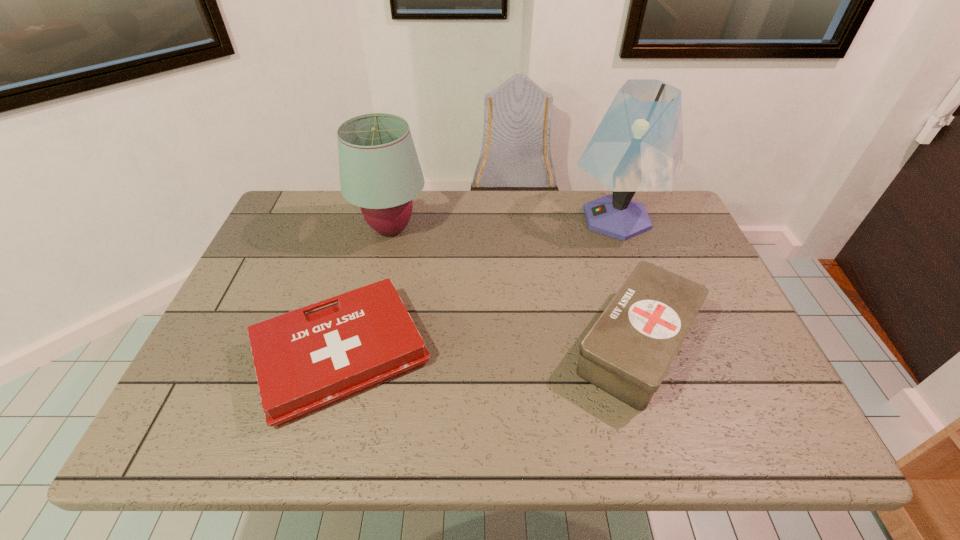
Find the location of a particular element. the right lampshade is located at coordinates [x=638, y=146].

Where is `the taller lampshade`? The image size is (960, 540). the taller lampshade is located at coordinates (638, 146).

Find the location of `the shorter lampshade`. the shorter lampshade is located at coordinates (380, 172).

Identify the location of the left lampshade. Image resolution: width=960 pixels, height=540 pixels. (380, 172).

The width and height of the screenshot is (960, 540). Find the location of `the second shortest object`. the second shortest object is located at coordinates (628, 351).

Locate an element on the screen. Image resolution: width=960 pixels, height=540 pixels. the right first-aid kit is located at coordinates (628, 351).

The width and height of the screenshot is (960, 540). In order to click on the shorter first-aid kit in this screenshot , I will do `click(304, 362)`.

Where is `the left first-aid kit`? This screenshot has height=540, width=960. the left first-aid kit is located at coordinates (304, 362).

Where is `vacant space positioned on the base of the tallest object`? This screenshot has width=960, height=540. vacant space positioned on the base of the tallest object is located at coordinates (506, 219).

Locate an element on the screen. vacant space located 0.070m on the base of the tallest object is located at coordinates (544, 219).